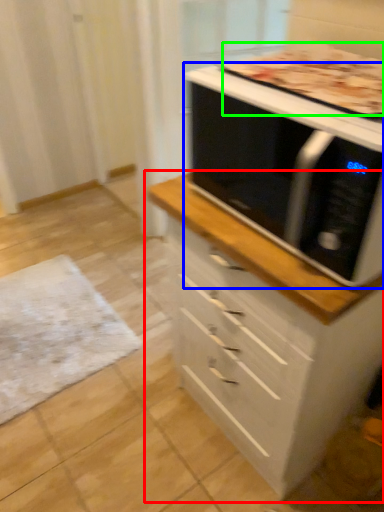
Question: Which object is the farthest from chest of drawers (highlighted by a red box)? Choose among these: microwave oven (highlighted by a blue box) or pizza (highlighted by a green box).

Choices:
 (A) microwave oven
 (B) pizza

Answer: (B)